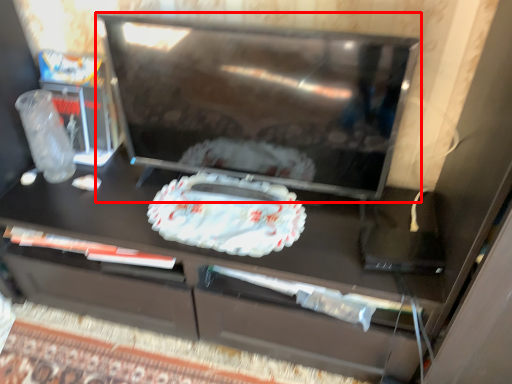
Question: In this image, where is appliance (annotated by the red box) located relative to food?

Choices:
 (A) left
 (B) right

Answer: (B)